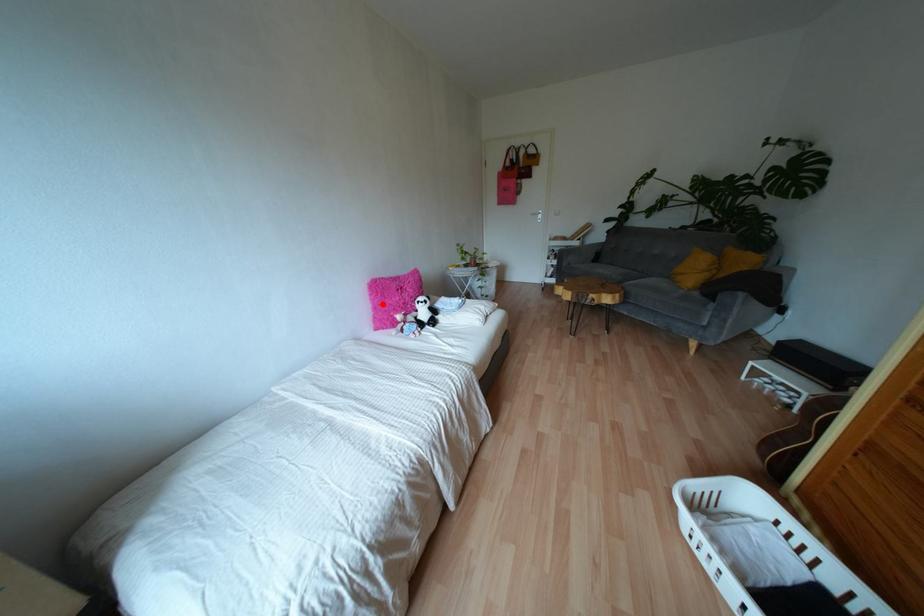
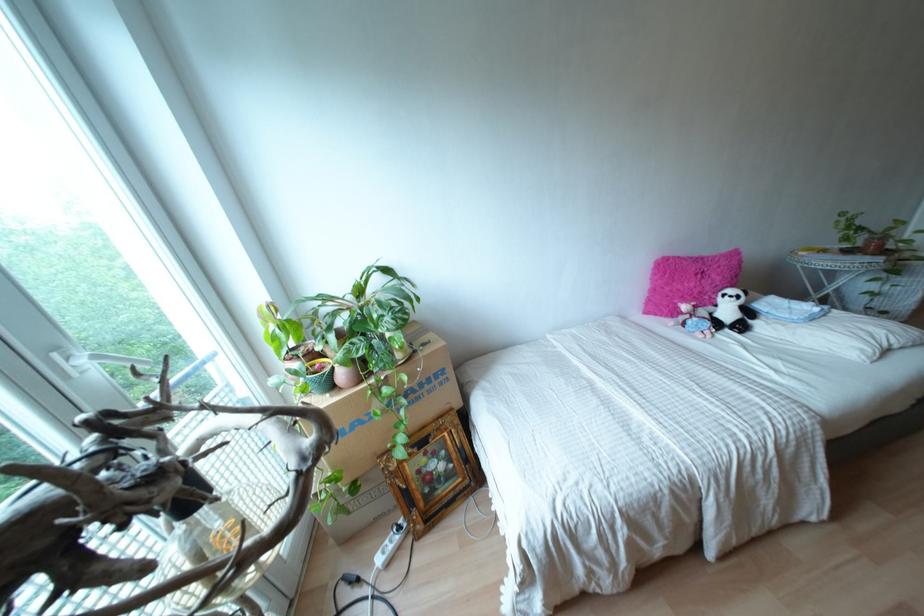
Where in the second image is the point corresponding to the highlighted location from the first image?

(666, 288)